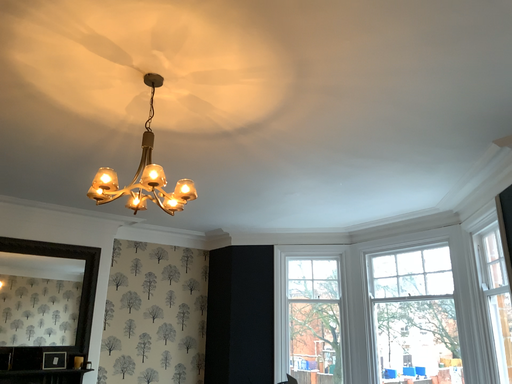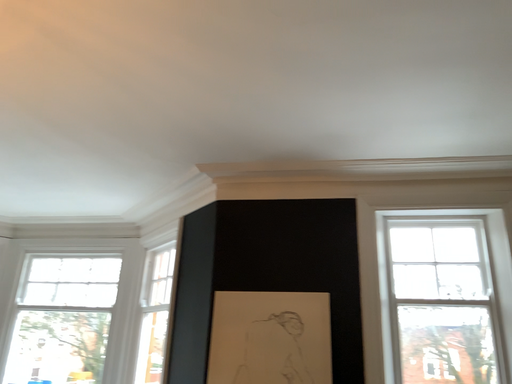
Question: How did the camera likely rotate when shooting the video?

Choices:
 (A) rotated right
 (B) rotated left

Answer: (A)